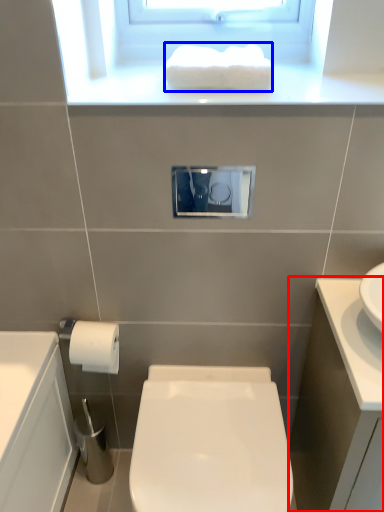
Question: Among these objects, which one is farthest to the camera, bathroom cabinet (highlighted by a red box) or hand towel (highlighted by a blue box)?

Choices:
 (A) bathroom cabinet
 (B) hand towel

Answer: (B)